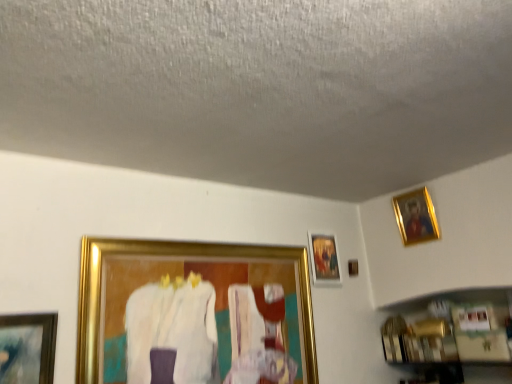
Question: Does gold metallic picture frame at center-left, arranged as the third picture frame when viewed from the right, have a greater height compared to gold metallic picture frame at upper right, which is counted as the first picture frame, starting from the right?

Choices:
 (A) no
 (B) yes

Answer: (B)

Question: Can you confirm if gold metallic picture frame at center-left, arranged as the third picture frame when viewed from the right, is bigger than gold metallic picture frame at upper right, which is counted as the first picture frame, starting from the right?

Choices:
 (A) no
 (B) yes

Answer: (B)

Question: From the image's perspective, does gold metallic picture frame at center-left, arranged as the third picture frame when viewed from the right, appear higher than gold metallic picture frame at upper right, the 3th picture frame positioned from the left?

Choices:
 (A) no
 (B) yes

Answer: (A)

Question: Is gold metallic picture frame at center-left, arranged as the third picture frame when viewed from the right, completely or partially outside of gold metallic picture frame at upper right, the 3th picture frame positioned from the left?

Choices:
 (A) yes
 (B) no

Answer: (A)

Question: Is gold metallic picture frame at center-left, which is the first picture frame from left to right, positioned far away from gold metallic picture frame at upper right, which is counted as the first picture frame, starting from the right?

Choices:
 (A) yes
 (B) no

Answer: (B)

Question: Does point (x=89, y=261) appear closer or farther from the camera than point (x=322, y=259)?

Choices:
 (A) closer
 (B) farther

Answer: (A)

Question: From the image's perspective, is gold metallic picture frame at center-left, which is the first picture frame from left to right, above or below gold-framed painting at upper right, which is counted as the second picture frame, starting from the right?

Choices:
 (A) below
 (B) above

Answer: (A)

Question: Considering the positions of gold metallic picture frame at center-left, arranged as the third picture frame when viewed from the right, and gold-framed painting at upper right, which is counted as the second picture frame, starting from the right, in the image, is gold metallic picture frame at center-left, arranged as the third picture frame when viewed from the right, taller or shorter than gold-framed painting at upper right, which is counted as the second picture frame, starting from the right,?

Choices:
 (A) short
 (B) tall

Answer: (B)

Question: In terms of width, does gold metallic picture frame at center-left, arranged as the third picture frame when viewed from the right, look wider or thinner when compared to gold-framed painting at upper right, which is counted as the second picture frame, starting from the right?

Choices:
 (A) wide
 (B) thin

Answer: (A)

Question: Is gold metallic picture frame at upper right, which is counted as the first picture frame, starting from the right, in front of or behind gold metallic picture frame at center-left, which is the first picture frame from left to right, in the image?

Choices:
 (A) behind
 (B) front

Answer: (A)

Question: In the image, is gold metallic picture frame at upper right, which is counted as the first picture frame, starting from the right, on the left side or the right side of gold metallic picture frame at center-left, which is the first picture frame from left to right?

Choices:
 (A) right
 (B) left

Answer: (A)

Question: Is gold metallic picture frame at upper right, the 3th picture frame positioned from the left, wider or thinner than gold metallic picture frame at center-left, arranged as the third picture frame when viewed from the right?

Choices:
 (A) wide
 (B) thin

Answer: (B)

Question: Choose the correct answer: Is gold metallic picture frame at upper right, the 3th picture frame positioned from the left, inside gold metallic picture frame at center-left, which is the first picture frame from left to right, or outside it?

Choices:
 (A) inside
 (B) outside

Answer: (B)

Question: From the image's perspective, relative to gold metallic picture frame at upper right, the 3th picture frame positioned from the left, is gold metallic picture frame at center-left, arranged as the third picture frame when viewed from the right, above or below?

Choices:
 (A) above
 (B) below

Answer: (B)

Question: Considering the relative positions of gold metallic picture frame at center-left, which is the first picture frame from left to right, and gold metallic picture frame at upper right, the 3th picture frame positioned from the left, in the image provided, is gold metallic picture frame at center-left, which is the first picture frame from left to right, to the left or to the right of gold metallic picture frame at upper right, the 3th picture frame positioned from the left,?

Choices:
 (A) left
 (B) right

Answer: (A)